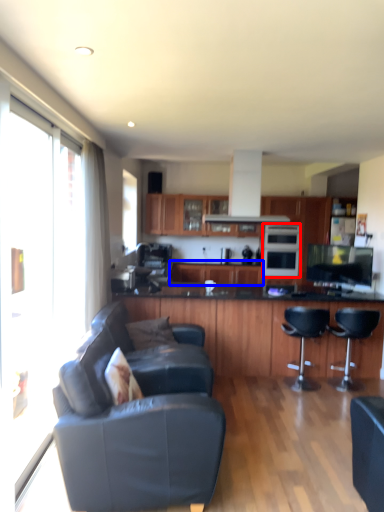
Question: Which of the following is the closest to the observer, oven (highlighted by a red box) or cabinetry (highlighted by a blue box)?

Choices:
 (A) oven
 (B) cabinetry

Answer: (A)